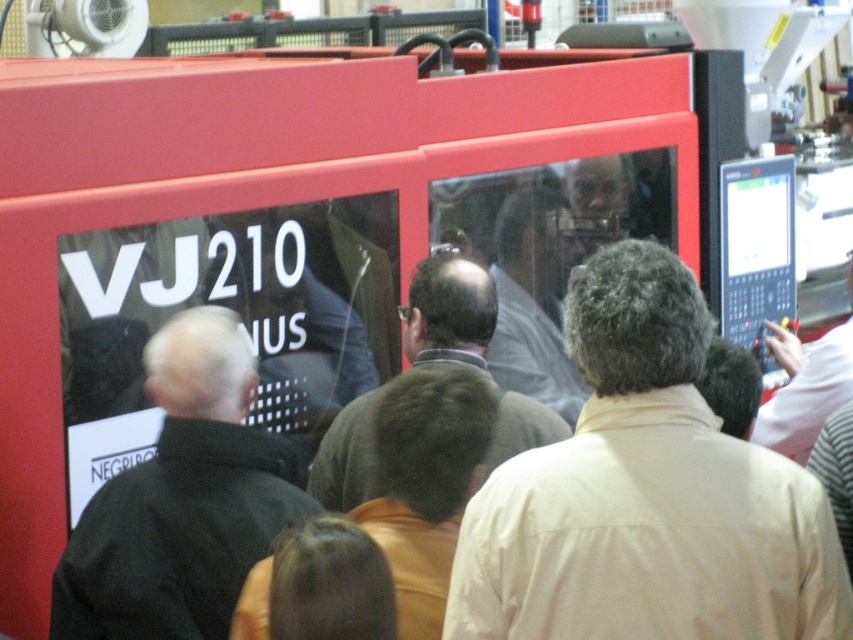
Can you confirm if beige fabric shirt at center is wider than black matte jacket at left?

Yes.

Between beige fabric shirt at center and black matte jacket at left, which one is positioned lower?

Positioned lower is black matte jacket at left.

Where is `beige fabric shirt at center`? This screenshot has width=853, height=640. beige fabric shirt at center is located at coordinates (646, 493).

Does dark brown sweater at center have a larger size compared to black plastic computer screen at right?

Indeed, dark brown sweater at center has a larger size compared to black plastic computer screen at right.

Consider the image. Is dark brown sweater at center positioned behind black plastic computer screen at right?

No, dark brown sweater at center is closer to the viewer.

This screenshot has height=640, width=853. Describe the element at coordinates (450, 310) in the screenshot. I see `dark brown sweater at center` at that location.

This screenshot has height=640, width=853. Identify the location of dark brown sweater at center. (450, 310).

Is beige fabric shirt at center to the right of light gray shirt at center from the viewer's perspective?

Yes, beige fabric shirt at center is to the right of light gray shirt at center.

Does beige fabric shirt at center come behind light gray shirt at center?

No, beige fabric shirt at center is in front of light gray shirt at center.

Does point (476, 493) come in front of point (538, 250)?

Yes, it is.

Where is `beige fabric shirt at center`? This screenshot has width=853, height=640. beige fabric shirt at center is located at coordinates (646, 493).